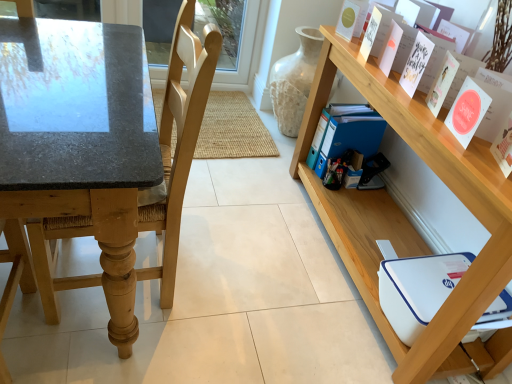
Where is `free space in front of white paper at upper right, the 3th paperback book when ordered from front to back`? The height and width of the screenshot is (384, 512). free space in front of white paper at upper right, the 3th paperback book when ordered from front to back is located at coordinates (419, 110).